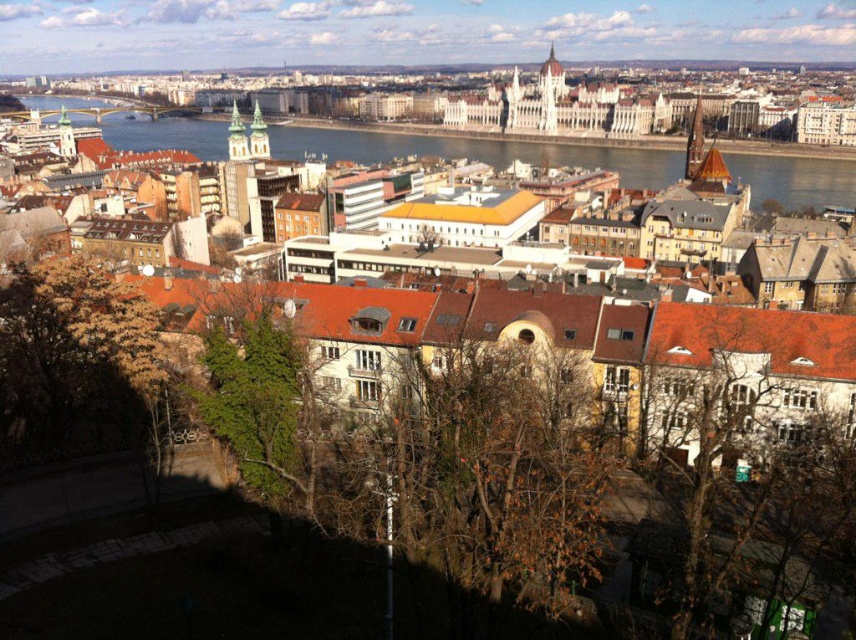
Which is behind, point (207, 148) or point (302, 150)?

Point (302, 150)

Is brown textured building at center taller than blue glass water at upper center?

Indeed, brown textured building at center has a greater height compared to blue glass water at upper center.

Is point (123, 124) closer to camera compared to point (349, 154)?

No.

The height and width of the screenshot is (640, 856). What are the coordinates of `brown textured building at center` in the screenshot? It's located at (489, 150).

The width and height of the screenshot is (856, 640). Describe the element at coordinates (530, 100) in the screenshot. I see `white stone building at upper center` at that location.

Is white stone building at upper center taller than blue glass water at upper center?

Incorrect, white stone building at upper center's height is not larger of blue glass water at upper center's.

You are a GUI agent. You are given a task and a screenshot of the screen. Output one action in this format:
    pyautogui.click(x=<x>, y=<y>)
    Task: Click on the white stone building at upper center
    The image size is (856, 640).
    Given the screenshot: What is the action you would take?
    pyautogui.click(x=530, y=100)

At what (x,y) coordinates should I click in order to perform the action: click on white stone building at upper center. Please return your answer as a coordinate pair (x, y). The width and height of the screenshot is (856, 640). Looking at the image, I should click on (530, 100).

Does white stone building at upper center appear under brown textured building at center?

Actually, white stone building at upper center is above brown textured building at center.

Which is in front, point (821, 102) or point (854, 268)?

Point (854, 268) is more forward.

Between point (123, 77) and point (596, 152), which one is positioned in front?

Point (596, 152)

This screenshot has height=640, width=856. What are the coordinates of `white stone building at upper center` in the screenshot? It's located at (530, 100).